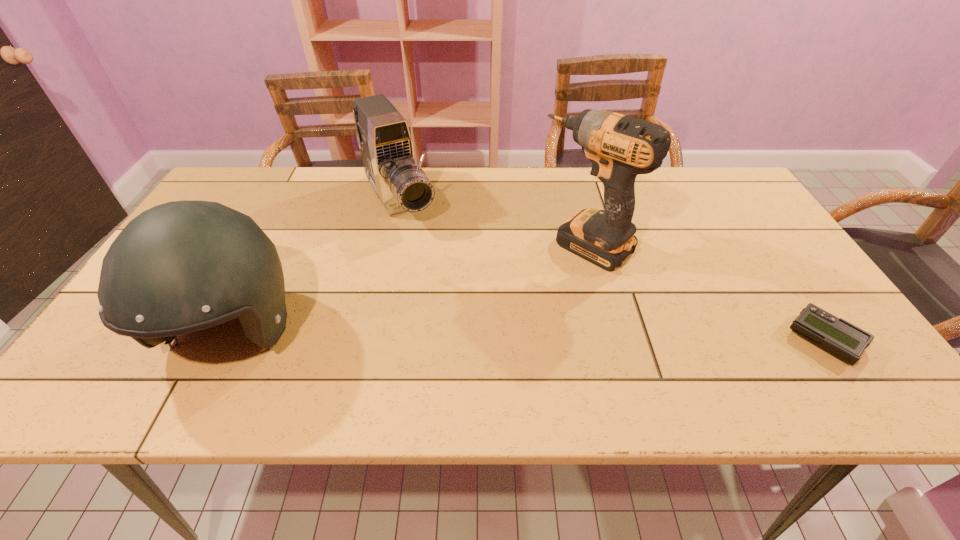
At what (x,y) coordinates should I click in order to perform the action: click on vacant space situated with the drill bit of the second object from right to left facing forward. Please return your answer as a coordinate pair (x, y). Looking at the image, I should click on [547, 279].

Locate an element on the screen. The image size is (960, 540). free region located 0.210m with the drill bit of the second object from right to left facing forward is located at coordinates (510, 314).

You are a GUI agent. You are given a task and a screenshot of the screen. Output one action in this format:
    pyautogui.click(x=<x>, y=<y>)
    Task: Click on the free space located 0.250m with the drill bit of the second object from right to left facing forward
    The width and height of the screenshot is (960, 540).
    Given the screenshot: What is the action you would take?
    pyautogui.click(x=499, y=324)

This screenshot has height=540, width=960. Identify the location of object that is at the far edge. (383, 136).

Locate an element on the screen. The image size is (960, 540). football helmet present at the near edge is located at coordinates (182, 266).

You are a GUI agent. You are given a task and a screenshot of the screen. Output one action in this format:
    pyautogui.click(x=<x>, y=<y>)
    Task: Click on the beeper present at the near edge
    
    Given the screenshot: What is the action you would take?
    pyautogui.click(x=840, y=338)

Image resolution: width=960 pixels, height=540 pixels. I want to click on object that is at the left edge, so click(182, 266).

Locate an element on the screen. This screenshot has height=540, width=960. object that is at the right edge is located at coordinates (840, 338).

Locate an element on the screen. This screenshot has width=960, height=540. object that is at the near left corner is located at coordinates (182, 266).

Identify the location of object that is positioned at the near right corner. (840, 338).